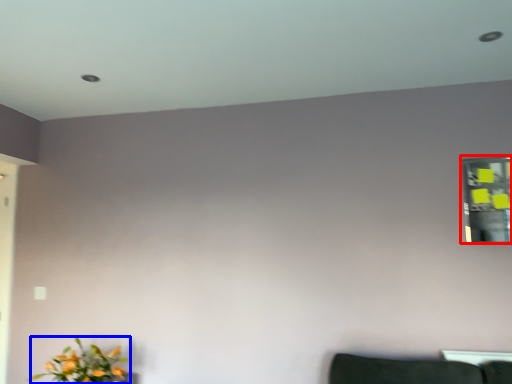
Question: Which point is closer to the camera, mirror (highlighted by a red box) or flower (highlighted by a blue box)?

Choices:
 (A) mirror
 (B) flower

Answer: (B)